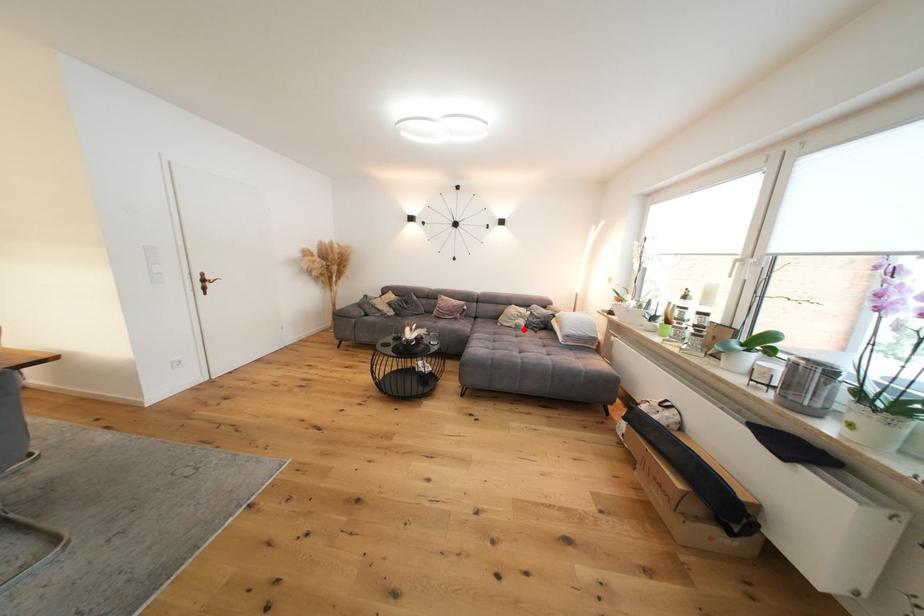
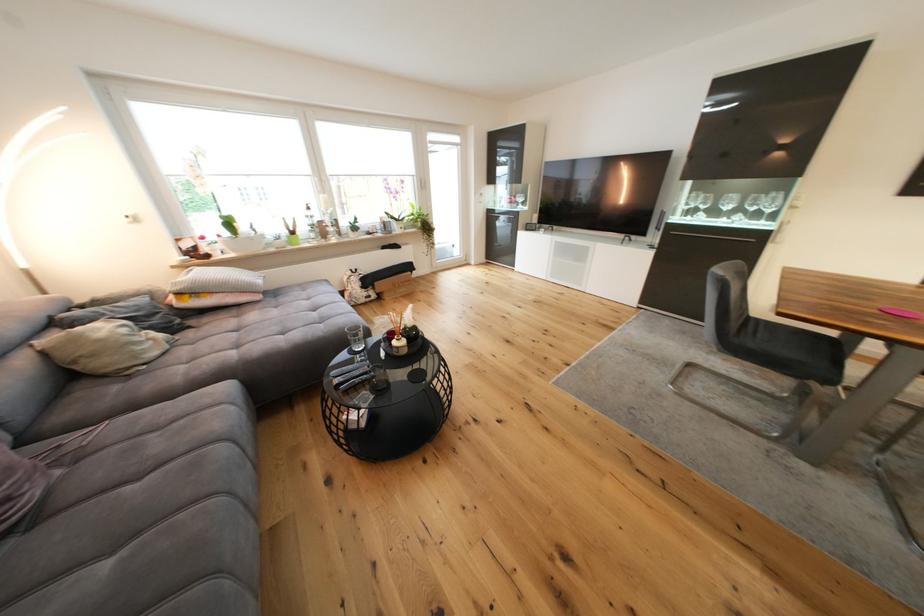
Find the pixel in the second image that matches the highlighted location in the first image.

(178, 345)